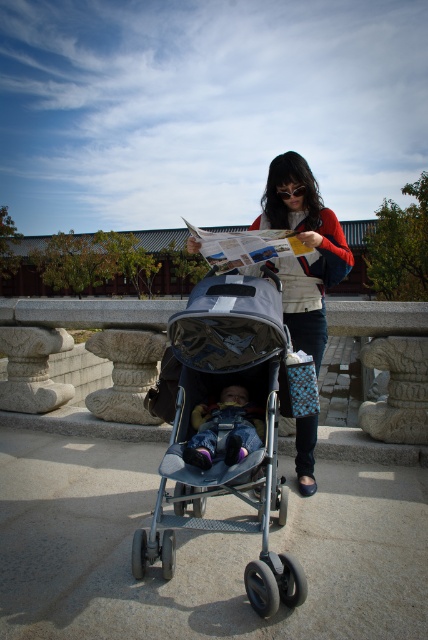
Question: Which is nearer to the gray matte stroller at center?

Choices:
 (A) matte white jacket at center
 (B) denim pants at center

Answer: (B)

Question: Which object is positioned closest to the matte white jacket at center?

Choices:
 (A) gray matte stroller at center
 (B) denim pants at center

Answer: (A)

Question: Is matte white jacket at center smaller than denim pants at center?

Choices:
 (A) yes
 (B) no

Answer: (B)

Question: Among these objects, which one is nearest to the camera?

Choices:
 (A) gray matte stroller at center
 (B) denim pants at center

Answer: (A)

Question: Does matte white jacket at center come behind denim pants at center?

Choices:
 (A) yes
 (B) no

Answer: (A)

Question: Is gray matte stroller at center wider than matte white jacket at center?

Choices:
 (A) yes
 (B) no

Answer: (A)